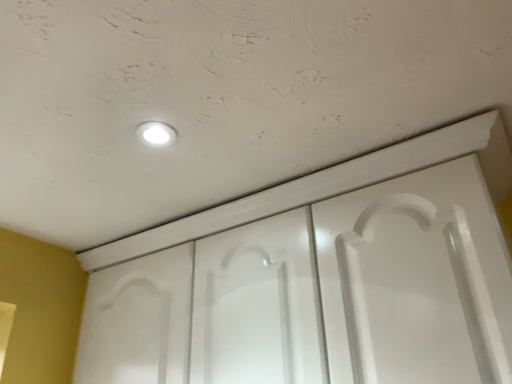
Question: In terms of height, does white glossy light fixture at upper center look taller or shorter compared to white glossy door at center?

Choices:
 (A) tall
 (B) short

Answer: (B)

Question: Is point (138, 135) closer or farther from the camera than point (174, 317)?

Choices:
 (A) farther
 (B) closer

Answer: (B)

Question: From a real-world perspective, is white glossy light fixture at upper center positioned above or below white glossy door at center?

Choices:
 (A) below
 (B) above

Answer: (B)

Question: From a real-world perspective, is white glossy door at center positioned above or below white glossy light fixture at upper center?

Choices:
 (A) below
 (B) above

Answer: (A)

Question: Considering their positions, is white glossy door at center located in front of or behind white glossy light fixture at upper center?

Choices:
 (A) behind
 (B) front

Answer: (B)

Question: Considering the positions of white glossy door at center and white glossy light fixture at upper center in the image, is white glossy door at center wider or thinner than white glossy light fixture at upper center?

Choices:
 (A) wide
 (B) thin

Answer: (A)

Question: Is white glossy door at center taller or shorter than white glossy light fixture at upper center?

Choices:
 (A) short
 (B) tall

Answer: (B)